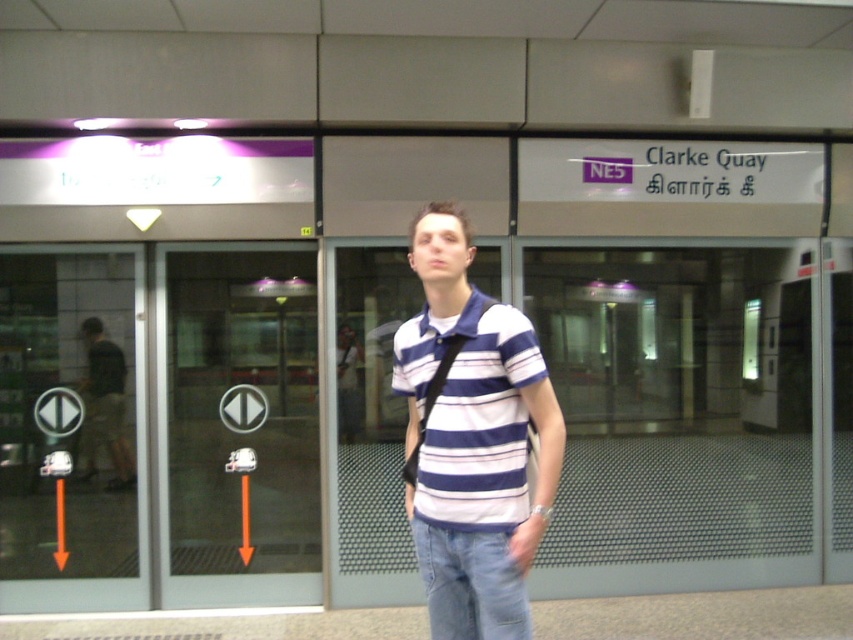
You are a photographer trying to capture both the striped cotton shirt at center and the dark gray shirt at left in a single shot. Which shirt should you focus on to ensure both are in clear focus?

You should focus on the striped cotton shirt at center because it is closer to the viewer than the dark gray shirt at left, so focusing on the closer object will keep both in focus.

You are standing at the subway station platform and want to take a photo of both the point at coordinates point (294,468) and point (112,486). Since you can only focus on one point at a time, which point should you focus on first to ensure both are in the frame?

You should focus on point (294,468) first because it is further away from the camera than point (112,486). By focusing on the further point, the closer point will also be in focus due to the depth of field.

You are standing on the subway platform and see the transparent glass door at left and the dark gray shirt at left. Which object is positioned to the right of the other?

The transparent glass door at left is to the right of dark gray shirt at left according to the description.